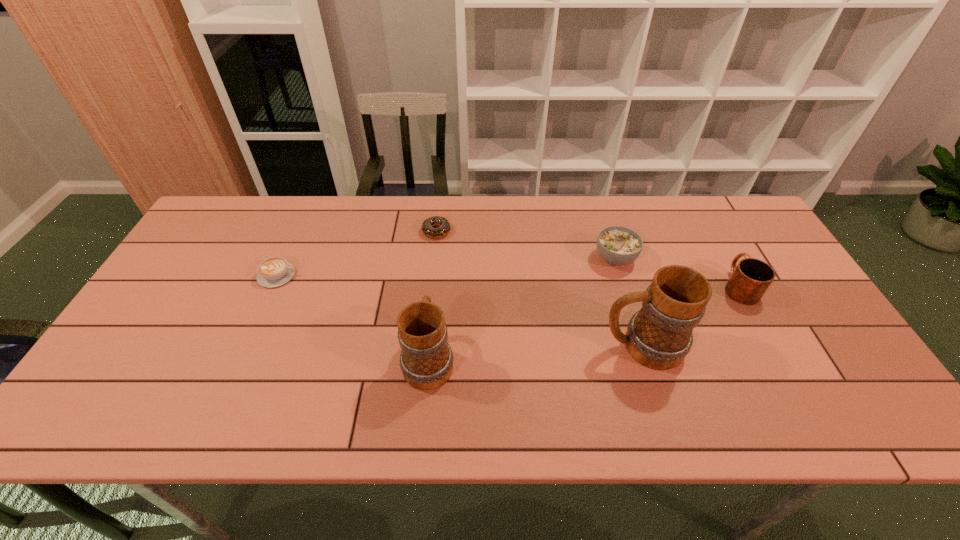
Please show where to add a mug on the left while keeping spacing even. Please provide its 2D coordinates. Your answer should be formatted as a tuple, i.e. [(x, y)], where the tuple contains the x and y coordinates of a point satisfying the conditions above.

[(204, 373)]